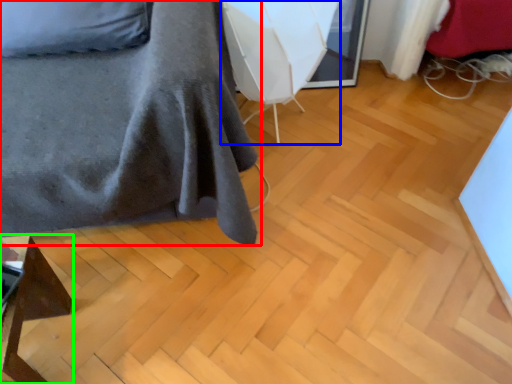
Question: Based on their relative distances, which object is farther from furniture (highlighted by a red box)? Choose from swivel chair (highlighted by a blue box) and furniture (highlighted by a green box).

Choices:
 (A) swivel chair
 (B) furniture

Answer: (B)